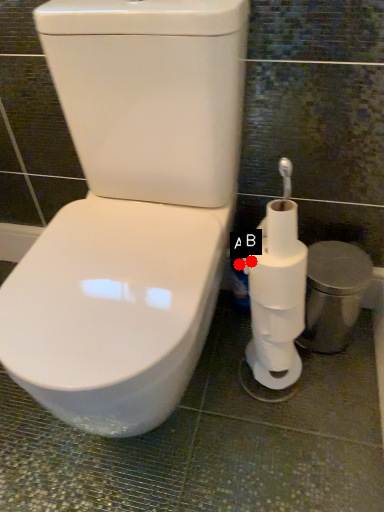
Question: Two points are circled on the image, labeled by A and B beside each circle. Which point is closer to the camera?

Choices:
 (A) A is closer
 (B) B is closer

Answer: (B)